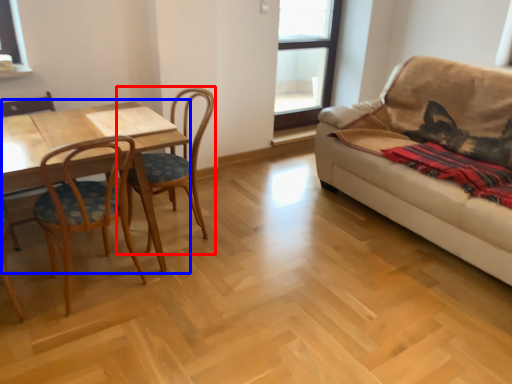
Question: Which object appears farthest to the camera in this image, chair (highlighted by a red box) or table (highlighted by a blue box)?

Choices:
 (A) chair
 (B) table

Answer: (A)